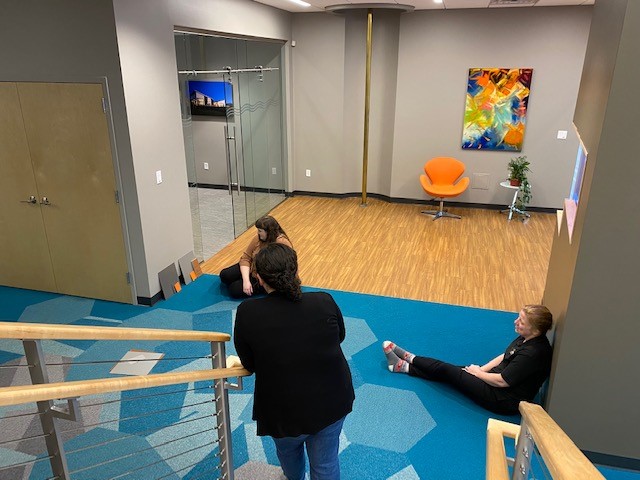
Identify the location of tan doors. This screenshot has width=640, height=480. point(16,173), point(65,166).